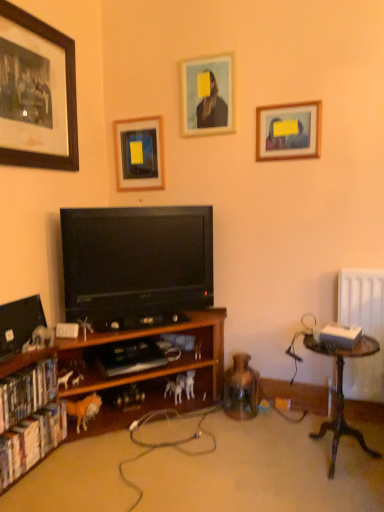
Image resolution: width=384 pixels, height=512 pixels. I want to click on free space between hardcover book at lower left, which is the 1th book in bottom-to-top order, and white matte horse at lower center, the third animal when ordered from front to back, so click(x=102, y=442).